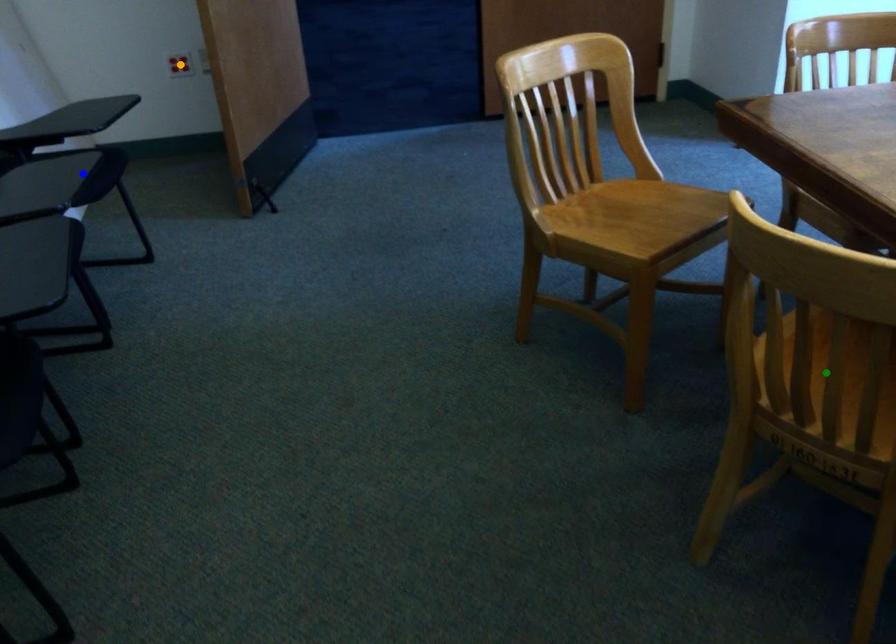
Order these from nearest to farthest:
1. green point
2. blue point
3. orange point

green point, blue point, orange point